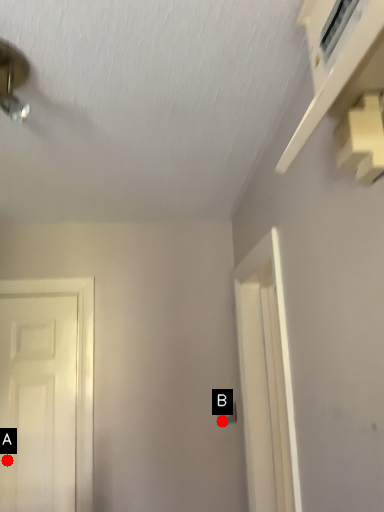
Question: Two points are circled on the image, labeled by A and B beside each circle. Which point is further to the camera?

Choices:
 (A) A is further
 (B) B is further

Answer: (B)